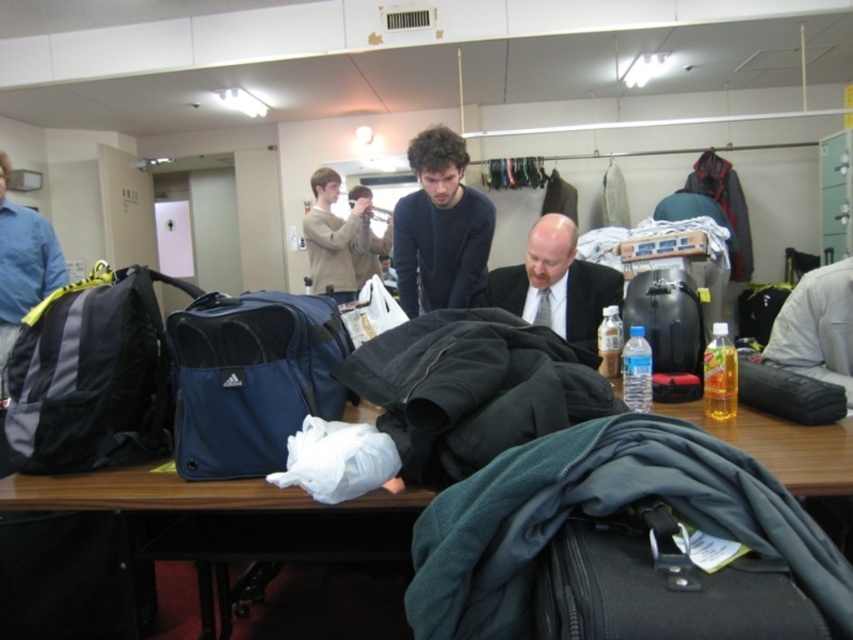
The width and height of the screenshot is (853, 640). What do you see at coordinates (660, 586) in the screenshot? I see `black matte suitcase at lower right` at bounding box center [660, 586].

Which is behind, point (566, 545) or point (726, 339)?

Positioned behind is point (726, 339).

This screenshot has width=853, height=640. Describe the element at coordinates (660, 586) in the screenshot. I see `black matte suitcase at lower right` at that location.

Find the location of `black matte suitcase at lower right`. black matte suitcase at lower right is located at coordinates (660, 586).

The height and width of the screenshot is (640, 853). Identify the location of matte blue shirt at left. (22, 264).

Can you confirm if matte blue shirt at left is smaller than light brown sweater at center?

No, matte blue shirt at left is not smaller than light brown sweater at center.

Between point (16, 321) and point (332, 253), which one is positioned in front?

Positioned in front is point (16, 321).

You are a GUI agent. You are given a task and a screenshot of the screen. Output one action in this format:
    pyautogui.click(x=<x>, y=<y>)
    Task: Click on the matte blue shirt at left
    The height and width of the screenshot is (640, 853).
    Given the screenshot: What is the action you would take?
    pyautogui.click(x=22, y=264)

Does light brown sweater at center appear on the right side of translucent plastic bottle at center?

In fact, light brown sweater at center is to the left of translucent plastic bottle at center.

Image resolution: width=853 pixels, height=640 pixels. What do you see at coordinates (334, 237) in the screenshot? I see `light brown sweater at center` at bounding box center [334, 237].

Locate an element on the screen. This screenshot has width=853, height=640. light brown sweater at center is located at coordinates (334, 237).